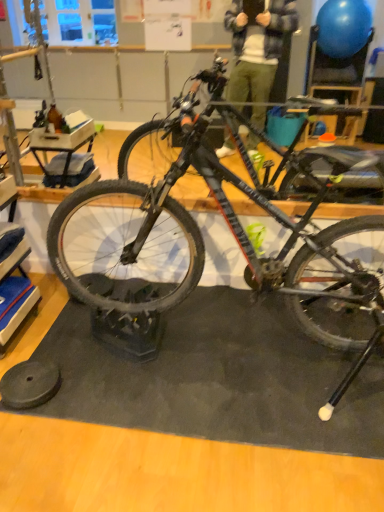
Question: Considering the relative positions of shiny black tire at center and black rubber wheel at lower left in the image provided, is shiny black tire at center in front of black rubber wheel at lower left?

Choices:
 (A) yes
 (B) no

Answer: (A)

Question: From the image's perspective, is shiny black tire at center over black rubber wheel at lower left?

Choices:
 (A) no
 (B) yes

Answer: (B)

Question: Is shiny black tire at center placed right next to black rubber wheel at lower left?

Choices:
 (A) yes
 (B) no

Answer: (B)

Question: Would you say shiny black tire at center is a long distance from black rubber wheel at lower left?

Choices:
 (A) no
 (B) yes

Answer: (B)

Question: Is shiny black tire at center smaller than black rubber wheel at lower left?

Choices:
 (A) yes
 (B) no

Answer: (B)

Question: Considering the positions of shiny black tire at center and black rubber wheel at lower left in the image, is shiny black tire at center taller or shorter than black rubber wheel at lower left?

Choices:
 (A) tall
 (B) short

Answer: (A)

Question: Considering the positions of shiny black tire at center and black rubber wheel at lower left in the image, is shiny black tire at center bigger or smaller than black rubber wheel at lower left?

Choices:
 (A) small
 (B) big

Answer: (B)

Question: From a real-world perspective, is shiny black tire at center above or below black rubber wheel at lower left?

Choices:
 (A) above
 (B) below

Answer: (A)

Question: Is shiny black tire at center in front of or behind black rubber wheel at lower left in the image?

Choices:
 (A) behind
 (B) front

Answer: (B)

Question: Choose the correct answer: Is black rubber wheel at lower left inside shiny black tire at center or outside it?

Choices:
 (A) inside
 (B) outside

Answer: (B)

Question: From a real-world perspective, relative to shiny black tire at center, is black rubber wheel at lower left vertically above or below?

Choices:
 (A) above
 (B) below

Answer: (B)

Question: Based on their positions, is black rubber wheel at lower left located to the left or right of shiny black tire at center?

Choices:
 (A) left
 (B) right

Answer: (A)

Question: From the image's perspective, relative to shiny black tire at center, is black rubber wheel at lower left above or below?

Choices:
 (A) above
 (B) below

Answer: (B)

Question: From the image's perspective, is black rubber wheel at lower left above or below matte black bicycle at center?

Choices:
 (A) above
 (B) below

Answer: (B)

Question: Considering the positions of point (13, 373) and point (99, 251), is point (13, 373) closer or farther from the camera than point (99, 251)?

Choices:
 (A) closer
 (B) farther

Answer: (A)